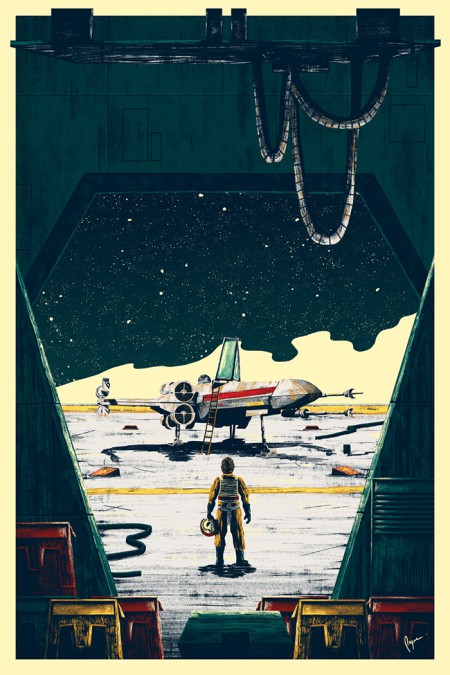
Locate an element on the screen. This screenshot has width=450, height=675. door openint is located at coordinates (76, 480), (369, 468).